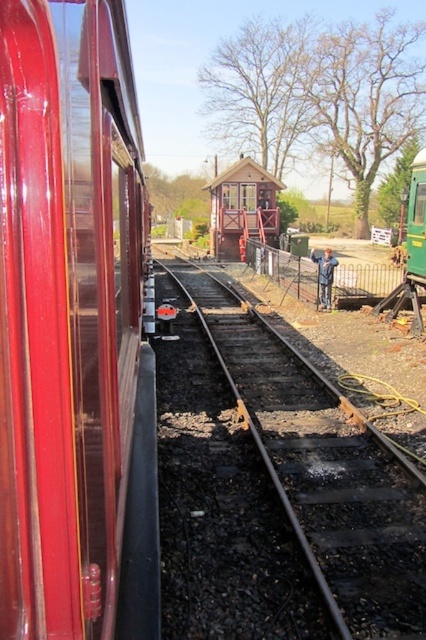
You are a maintenance worker needing to walk along the black metal track at center. Given that the track is narrower than the green matte train at center, will you have enough space to walk safely on the track?

The black metal track at center has a lesser width compared to the green matte train at center, so the track is narrower than the train. Since the track is narrower, there might not be enough space to walk safely on it. It is advisable to use designated pathways for safety.

You are a passenger waiting at the station. You see the shiny red train car at left and the black metal track at center. Which object is closer to you as you stand on the platform?

The shiny red train car at left is closer to you because it is positioned in front of the black metal track at center, meaning it is nearer to your viewpoint on the platform.

You are standing at the railway station and want to take a photo of both the red train car and the signal box. The points you need to focus on are point (74,54) and point (412,278). Which point should you focus on first to ensure both are in focus?

You should focus on point (74,54) first because it is closer to the camera than point (412,278), ensuring both will be in focus when adjusting the camera settings.